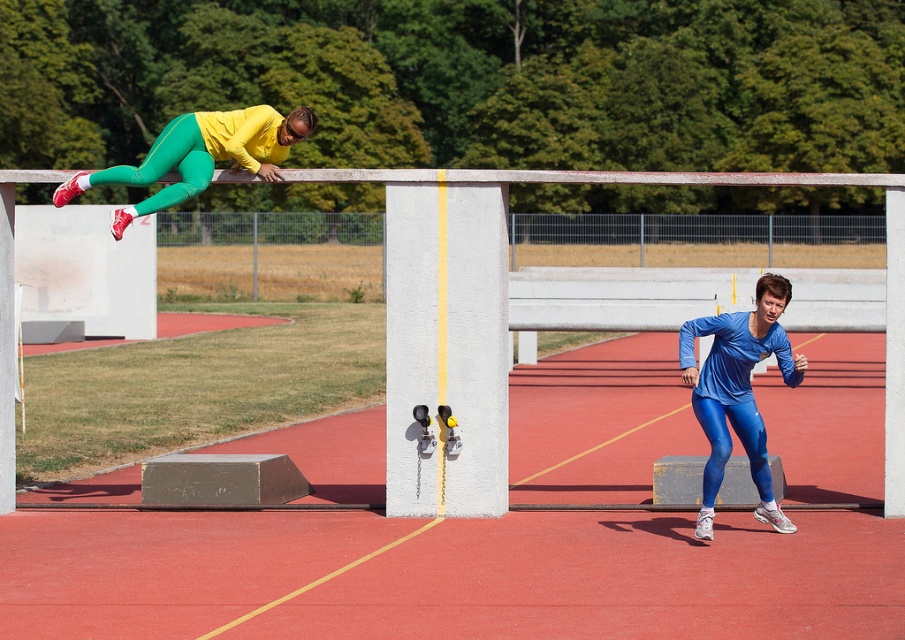
Question: Which object is positioned closest to the blue shiny leggings at lower right?

Choices:
 (A) matte yellow and green athletic suit at upper left
 (B) white concrete pillar at center

Answer: (B)

Question: Observing the image, what is the correct spatial positioning of white concrete pillar at center in reference to blue shiny leggings at lower right?

Choices:
 (A) left
 (B) right

Answer: (A)

Question: Which point is closer to the camera?

Choices:
 (A) white concrete pillar at center
 (B) blue shiny leggings at lower right
 (C) matte yellow and green athletic suit at upper left

Answer: (B)

Question: Can you confirm if white concrete pillar at center is positioned below blue shiny leggings at lower right?

Choices:
 (A) no
 (B) yes

Answer: (A)

Question: Does blue shiny leggings at lower right appear over matte yellow and green athletic suit at upper left?

Choices:
 (A) yes
 (B) no

Answer: (B)

Question: Which point appears farthest from the camera in this image?

Choices:
 (A) (272, 124)
 (B) (443, 445)
 (C) (801, 365)

Answer: (A)